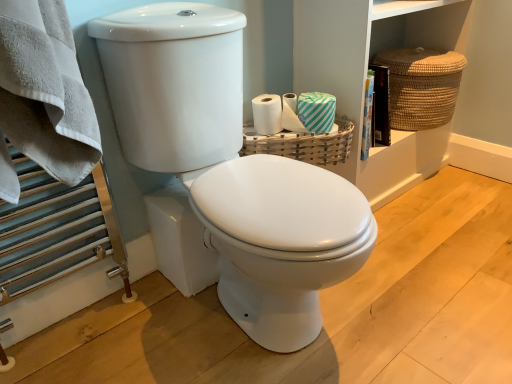
Question: Can you confirm if woven wood basket at upper right, marked as the 1th basket in a left-to-right arrangement, is wider than braided straw basket at upper right, placed as the first basket when sorted from right to left?

Choices:
 (A) yes
 (B) no

Answer: (B)

Question: Can you see woven wood basket at upper right, the 2th basket when ordered from top to bottom, touching braided straw basket at upper right, the 2th basket viewed from the front?

Choices:
 (A) no
 (B) yes

Answer: (A)

Question: Is woven wood basket at upper right, the second basket viewed from the right, at the right side of braided straw basket at upper right, which is the 1th basket from top to bottom?

Choices:
 (A) no
 (B) yes

Answer: (A)

Question: From a real-world perspective, is woven wood basket at upper right, the second basket viewed from the right, beneath braided straw basket at upper right, which is the second basket from left to right?

Choices:
 (A) no
 (B) yes

Answer: (B)

Question: Does woven wood basket at upper right, which is the 2th basket in back-to-front order, have a lesser height compared to braided straw basket at upper right, the 2th basket viewed from the front?

Choices:
 (A) yes
 (B) no

Answer: (A)

Question: Considering the positions of white glossy toilet at center, which is the first toilet from back to front, and teal striped tissue at upper right in the image, is white glossy toilet at center, which is the first toilet from back to front, taller or shorter than teal striped tissue at upper right?

Choices:
 (A) short
 (B) tall

Answer: (B)

Question: Is white glossy toilet at center, which is the first toilet from back to front, spatially inside teal striped tissue at upper right, or outside of it?

Choices:
 (A) outside
 (B) inside

Answer: (A)

Question: Is point (245, 157) closer or farther from the camera than point (324, 99)?

Choices:
 (A) closer
 (B) farther

Answer: (A)

Question: From the image's perspective, is white glossy toilet at center, which is the first toilet from back to front, located above or below teal striped tissue at upper right?

Choices:
 (A) below
 (B) above

Answer: (A)

Question: From the image's perspective, is woven wood basket at upper right, acting as the 1th basket starting from the front, positioned above or below teal striped tissue at upper right?

Choices:
 (A) above
 (B) below

Answer: (B)

Question: Considering the positions of woven wood basket at upper right, the 2th basket when ordered from top to bottom, and teal striped tissue at upper right in the image, is woven wood basket at upper right, the 2th basket when ordered from top to bottom, wider or thinner than teal striped tissue at upper right?

Choices:
 (A) thin
 (B) wide

Answer: (B)

Question: Is woven wood basket at upper right, the second basket viewed from the right, inside the boundaries of teal striped tissue at upper right, or outside?

Choices:
 (A) inside
 (B) outside

Answer: (B)

Question: Based on their sizes in the image, would you say woven wood basket at upper right, which is the 2th basket in back-to-front order, is bigger or smaller than teal striped tissue at upper right?

Choices:
 (A) small
 (B) big

Answer: (B)

Question: Is braided straw basket at upper right, the 2th basket viewed from the front, inside the boundaries of white glossy toilet at center, positioned as the first toilet in front-to-back order, or outside?

Choices:
 (A) inside
 (B) outside

Answer: (B)

Question: Is point (443, 64) positioned closer to the camera than point (209, 110)?

Choices:
 (A) farther
 (B) closer

Answer: (A)